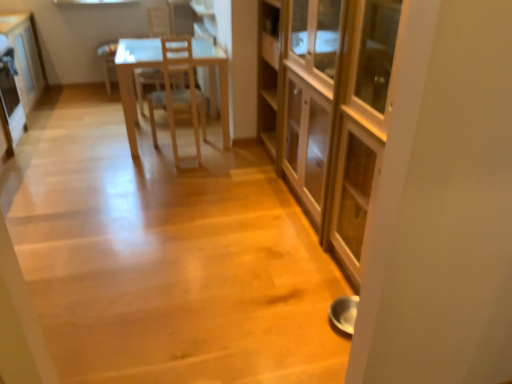
Find the location of a particular element. vacant region to the left of wooden chair at center is located at coordinates (113, 153).